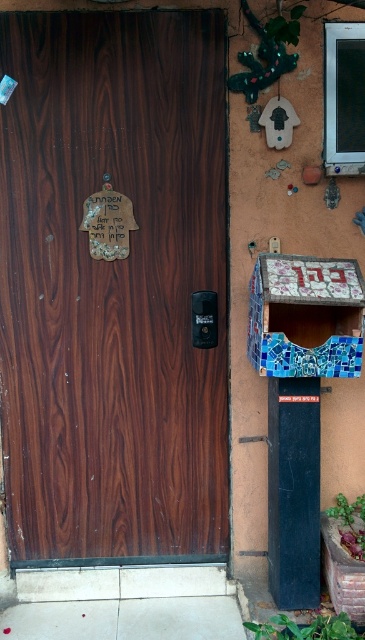
Question: Is brown wood door at center further to the viewer compared to black plastic phone box at center?

Choices:
 (A) no
 (B) yes

Answer: (A)

Question: Does mosaic tile bulletin board at right appear on the right side of black plastic phone box at center?

Choices:
 (A) no
 (B) yes

Answer: (B)

Question: Can you confirm if mosaic tile bulletin board at right is thinner than black plastic phone box at center?

Choices:
 (A) no
 (B) yes

Answer: (A)

Question: Among these objects, which one is nearest to the camera?

Choices:
 (A) black plastic phone box at center
 (B) mosaic tile bulletin board at right

Answer: (B)

Question: Which of these objects is positioned closest to the mosaic tile bulletin board at right?

Choices:
 (A) black plastic phone box at center
 (B) brown wood door at center

Answer: (A)

Question: Which of the following is the farthest from the observer?

Choices:
 (A) black plastic phone box at center
 (B) mosaic tile bulletin board at right

Answer: (A)